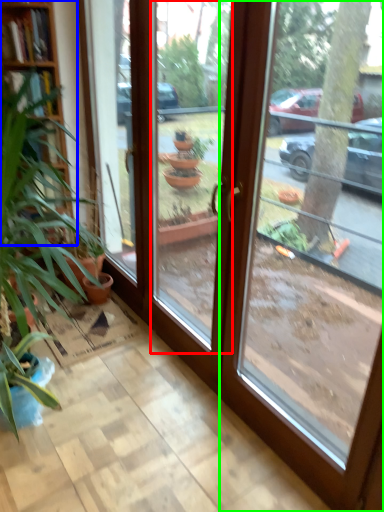
Question: Estimate the real-world distances between objects in this image. Which object is farther from window (highlighted by a red box), bookshelf (highlighted by a blue box) or window (highlighted by a green box)?

Choices:
 (A) bookshelf
 (B) window

Answer: (B)